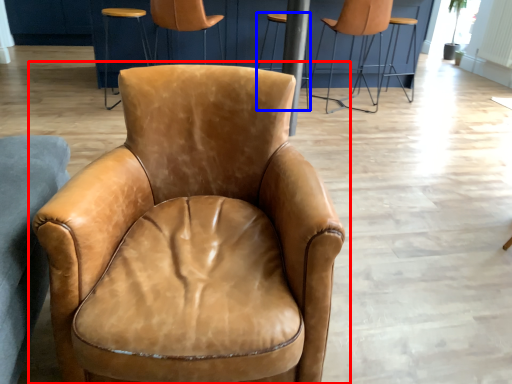
Question: Which object appears farthest to the camera in this image, chair (highlighted by a red box) or bar stool (highlighted by a blue box)?

Choices:
 (A) chair
 (B) bar stool

Answer: (B)